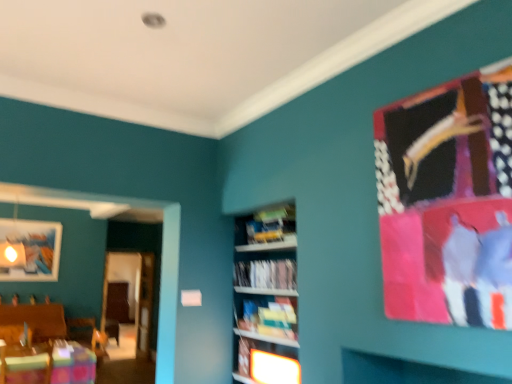
Question: Does yellow paperback book at center, which appears as the second book when viewed from the top, have a greater height compared to wooden table at lower left?

Choices:
 (A) no
 (B) yes

Answer: (A)

Question: Considering the relative positions of yellow paperback book at center, which appears as the second book when viewed from the top, and wooden table at lower left in the image provided, is yellow paperback book at center, which appears as the second book when viewed from the top, to the right of wooden table at lower left from the viewer's perspective?

Choices:
 (A) no
 (B) yes

Answer: (B)

Question: From a real-world perspective, is yellow paperback book at center, placed as the 1th book when sorted from bottom to top, on top of wooden table at lower left?

Choices:
 (A) no
 (B) yes

Answer: (B)

Question: Is yellow paperback book at center, placed as the 1th book when sorted from bottom to top, smaller than wooden table at lower left?

Choices:
 (A) no
 (B) yes

Answer: (B)

Question: Is yellow paperback book at center, which appears as the second book when viewed from the top, wider than wooden table at lower left?

Choices:
 (A) no
 (B) yes

Answer: (A)

Question: Is yellow paperback book at center, which appears as the second book when viewed from the top, to the left of wooden table at lower left from the viewer's perspective?

Choices:
 (A) no
 (B) yes

Answer: (A)

Question: Is yellow paperback book at center, which appears as the second book when viewed from the top, not near white paper at center, the second book positioned from the bottom?

Choices:
 (A) no
 (B) yes

Answer: (A)

Question: Is yellow paperback book at center, placed as the 1th book when sorted from bottom to top, closer to camera compared to white paper at center, the 1th book positioned from the top?

Choices:
 (A) no
 (B) yes

Answer: (A)

Question: Considering the relative sizes of yellow paperback book at center, placed as the 1th book when sorted from bottom to top, and white paper at center, the 1th book positioned from the top, in the image provided, is yellow paperback book at center, placed as the 1th book when sorted from bottom to top, shorter than white paper at center, the 1th book positioned from the top,?

Choices:
 (A) no
 (B) yes

Answer: (A)

Question: Could you tell me if yellow paperback book at center, placed as the 1th book when sorted from bottom to top, is facing white paper at center, the second book positioned from the bottom?

Choices:
 (A) no
 (B) yes

Answer: (A)

Question: Is yellow paperback book at center, placed as the 1th book when sorted from bottom to top, smaller than white paper at center, the second book positioned from the bottom?

Choices:
 (A) yes
 (B) no

Answer: (B)

Question: Considering the relative positions of yellow paperback book at center, placed as the 1th book when sorted from bottom to top, and white paper at center, the 1th book positioned from the top, in the image provided, is yellow paperback book at center, placed as the 1th book when sorted from bottom to top, to the right of white paper at center, the 1th book positioned from the top, from the viewer's perspective?

Choices:
 (A) no
 (B) yes

Answer: (B)

Question: Does yellow paperback book at center, which appears as the second book when viewed from the top, have a greater width compared to matte wooden picture frame at upper left?

Choices:
 (A) no
 (B) yes

Answer: (B)